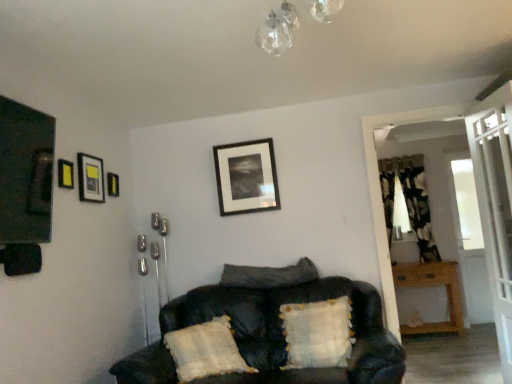
Question: Does white textured pillow at lower center, the third pillow from the right, have a greater height compared to black leather couch at center?

Choices:
 (A) yes
 (B) no

Answer: (B)

Question: Can you see white textured pillow at lower center, the third pillow from the right, touching black leather couch at center?

Choices:
 (A) yes
 (B) no

Answer: (B)

Question: Is white textured pillow at lower center, positioned as the first pillow in left-to-right order, facing away from black leather couch at center?

Choices:
 (A) no
 (B) yes

Answer: (B)

Question: Does white textured pillow at lower center, the third pillow from the right, have a lesser width compared to black leather couch at center?

Choices:
 (A) no
 (B) yes

Answer: (B)

Question: From the image's perspective, is white textured pillow at lower center, the third pillow from the right, on top of black leather couch at center?

Choices:
 (A) yes
 (B) no

Answer: (B)

Question: Considering the positions of transparent glass screen door at upper right, the 2th screen door from the back, and black matte picture frame at upper center, the first picture frame positioned from the back, in the image, is transparent glass screen door at upper right, the 2th screen door from the back, wider or thinner than black matte picture frame at upper center, the first picture frame positioned from the back,?

Choices:
 (A) wide
 (B) thin

Answer: (A)

Question: In the image, is transparent glass screen door at upper right, the 2th screen door from the back, on the left side or the right side of black matte picture frame at upper center, the first picture frame positioned from the back?

Choices:
 (A) left
 (B) right

Answer: (B)

Question: Is transparent glass screen door at upper right, the 2th screen door from the back, spatially inside black matte picture frame at upper center, the first picture frame when ordered from right to left, or outside of it?

Choices:
 (A) inside
 (B) outside

Answer: (B)

Question: In terms of size, does transparent glass screen door at upper right, which is the first screen door from front to back, appear bigger or smaller than black matte picture frame at upper center, which is the 4th picture frame in front-to-back order?

Choices:
 (A) big
 (B) small

Answer: (A)

Question: Considering the relative positions of velvety dark gray pillow at center, arranged as the second pillow when viewed from the left, and white textured pillow at lower center, positioned as the first pillow in left-to-right order, in the image provided, is velvety dark gray pillow at center, arranged as the second pillow when viewed from the left, to the left or to the right of white textured pillow at lower center, positioned as the first pillow in left-to-right order,?

Choices:
 (A) left
 (B) right

Answer: (B)

Question: Is velvety dark gray pillow at center, arranged as the second pillow when viewed from the left, inside or outside of white textured pillow at lower center, the third pillow from the right?

Choices:
 (A) inside
 (B) outside

Answer: (B)

Question: From their relative heights in the image, would you say velvety dark gray pillow at center, arranged as the second pillow when viewed from the left, is taller or shorter than white textured pillow at lower center, positioned as the first pillow in left-to-right order?

Choices:
 (A) tall
 (B) short

Answer: (B)

Question: Based on their sizes in the image, would you say velvety dark gray pillow at center, which is counted as the second pillow, starting from the right, is bigger or smaller than white textured pillow at lower center, positioned as the first pillow in left-to-right order?

Choices:
 (A) small
 (B) big

Answer: (A)

Question: Visually, is wooden table at right positioned to the left or to the right of matte black picture frame at upper left, marked as the third picture frame in a right-to-left arrangement?

Choices:
 (A) left
 (B) right

Answer: (B)

Question: From a real-world perspective, is wooden table at right positioned above or below matte black picture frame at upper left, marked as the third picture frame in a right-to-left arrangement?

Choices:
 (A) above
 (B) below

Answer: (B)